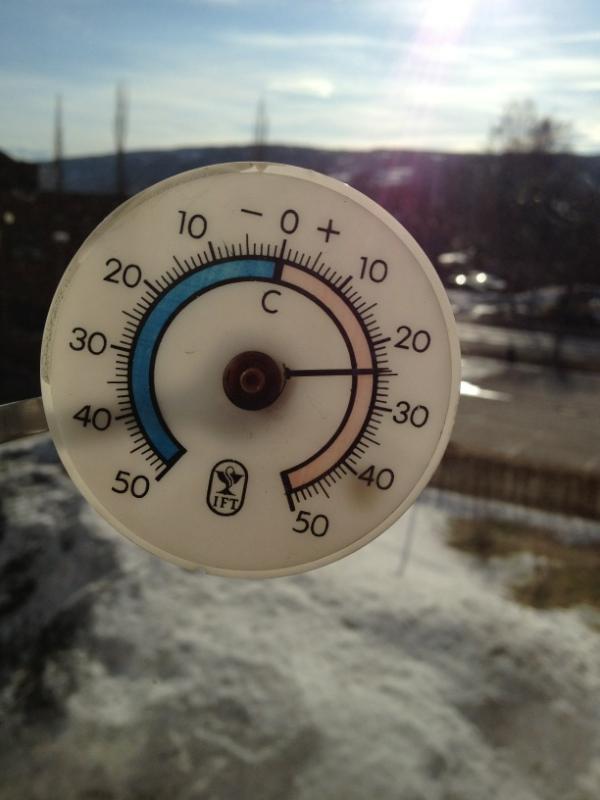
Identify the location of thermometer in centigrade. (135, 225).